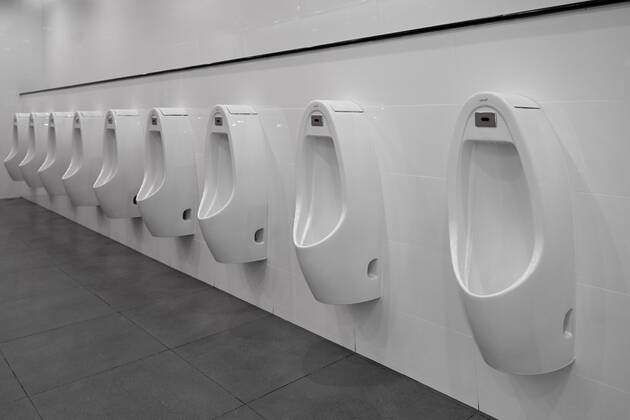
At what (x,y) coordinates should I click in order to perform the action: click on urinal. Please return your answer as a coordinate pair (x, y). This screenshot has height=420, width=630. Looking at the image, I should click on (13, 161), (28, 161), (52, 171), (86, 158), (120, 153), (171, 161), (230, 166), (356, 179), (528, 210).